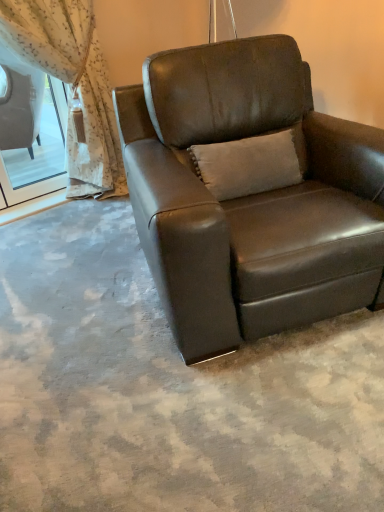
Question: Is suede beige pillow at center surrounding brown leather chair at center?

Choices:
 (A) no
 (B) yes

Answer: (A)

Question: Is suede beige pillow at center thinner than brown leather chair at center?

Choices:
 (A) yes
 (B) no

Answer: (A)

Question: Is suede beige pillow at center positioned far away from brown leather chair at center?

Choices:
 (A) no
 (B) yes

Answer: (A)

Question: From a real-world perspective, is suede beige pillow at center over brown leather chair at center?

Choices:
 (A) no
 (B) yes

Answer: (B)

Question: Is suede beige pillow at center shorter than brown leather chair at center?

Choices:
 (A) no
 (B) yes

Answer: (B)

Question: Is suede beige pillow at center touching brown leather chair at center?

Choices:
 (A) no
 (B) yes

Answer: (A)

Question: Is suede beige pillow at center oriented away from sheer floral fabric at upper left?

Choices:
 (A) yes
 (B) no

Answer: (A)

Question: Can you confirm if suede beige pillow at center is positioned to the left of sheer floral fabric at upper left?

Choices:
 (A) no
 (B) yes

Answer: (A)

Question: From the image's perspective, would you say suede beige pillow at center is positioned over sheer floral fabric at upper left?

Choices:
 (A) yes
 (B) no

Answer: (B)

Question: Is suede beige pillow at center thinner than sheer floral fabric at upper left?

Choices:
 (A) yes
 (B) no

Answer: (A)

Question: From a real-world perspective, is suede beige pillow at center below sheer floral fabric at upper left?

Choices:
 (A) yes
 (B) no

Answer: (A)

Question: Does suede beige pillow at center have a greater width compared to sheer floral fabric at upper left?

Choices:
 (A) no
 (B) yes

Answer: (A)

Question: Considering the relative positions of sheer floral fabric at upper left and brown leather chair at center in the image provided, is sheer floral fabric at upper left behind brown leather chair at center?

Choices:
 (A) no
 (B) yes

Answer: (B)